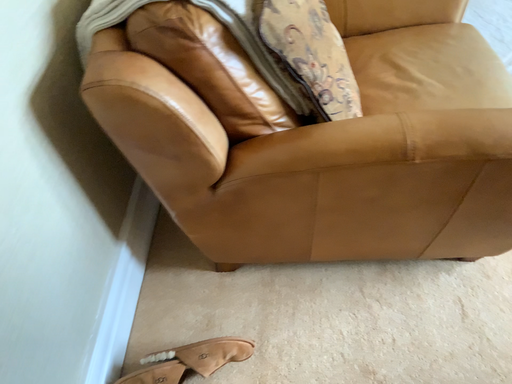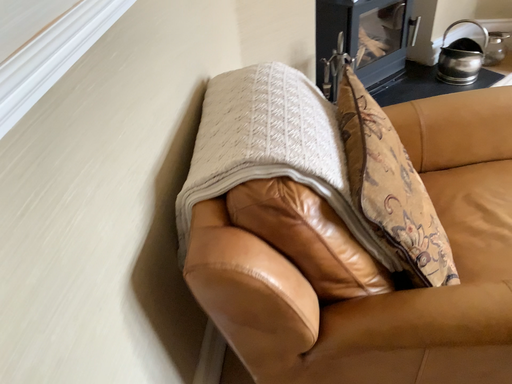
Question: How did the camera likely rotate when shooting the video?

Choices:
 (A) rotated downward
 (B) rotated upward

Answer: (B)